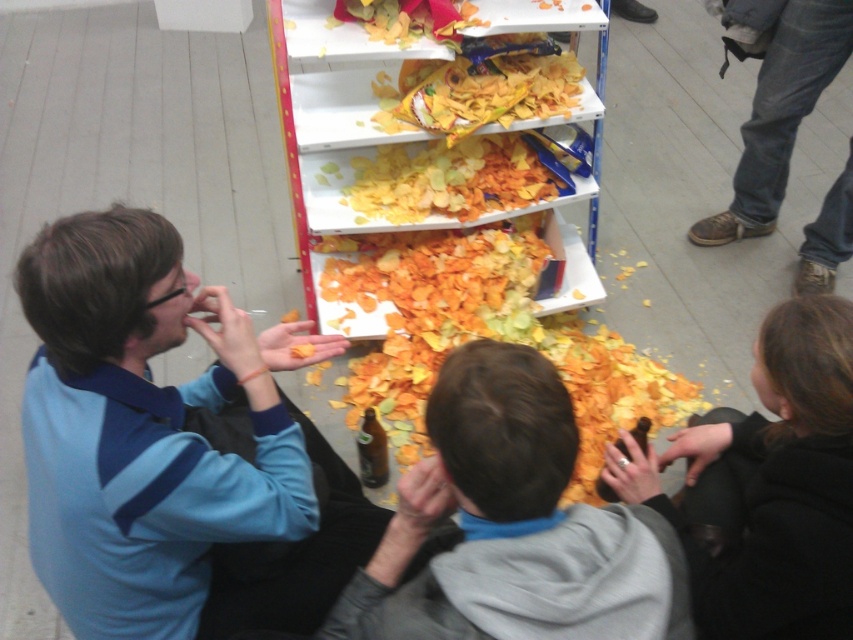
Consider the image. You are standing at point (173, 468) and want to reach the snack shelf that is 1.30 meters away. Can you walk directly to it without moving any objects?

Yes, since the distance between you and the snack shelf is 1.30 meters, you can walk directly to it without needing to move any objects as there is enough space.